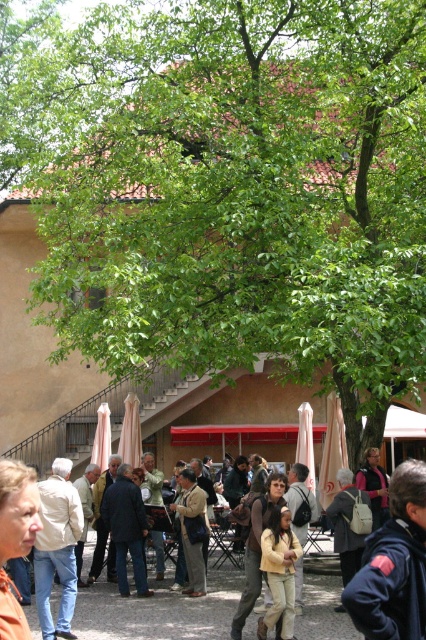
Consider the image. Can you confirm if beige fabric backpack at center is smaller than pink fabric bag at center?

Incorrect, beige fabric backpack at center is not smaller in size than pink fabric bag at center.

Who is positioned more to the left, beige fabric backpack at center or pink fabric bag at center?

beige fabric backpack at center

What are the coordinates of `beige fabric backpack at center` in the screenshot? It's located at (301, 500).

Is brown leather jacket at lower left shorter than light yellow fabric jacket at center?

Indeed, brown leather jacket at lower left has a lesser height compared to light yellow fabric jacket at center.

Find the location of a particular element. brown leather jacket at lower left is located at coordinates (16, 538).

Is dark gray jacket at center below beige fabric backpack at center?

Yes, dark gray jacket at center is below beige fabric backpack at center.

The image size is (426, 640). What are the coordinates of `dark gray jacket at center` in the screenshot? It's located at (126, 529).